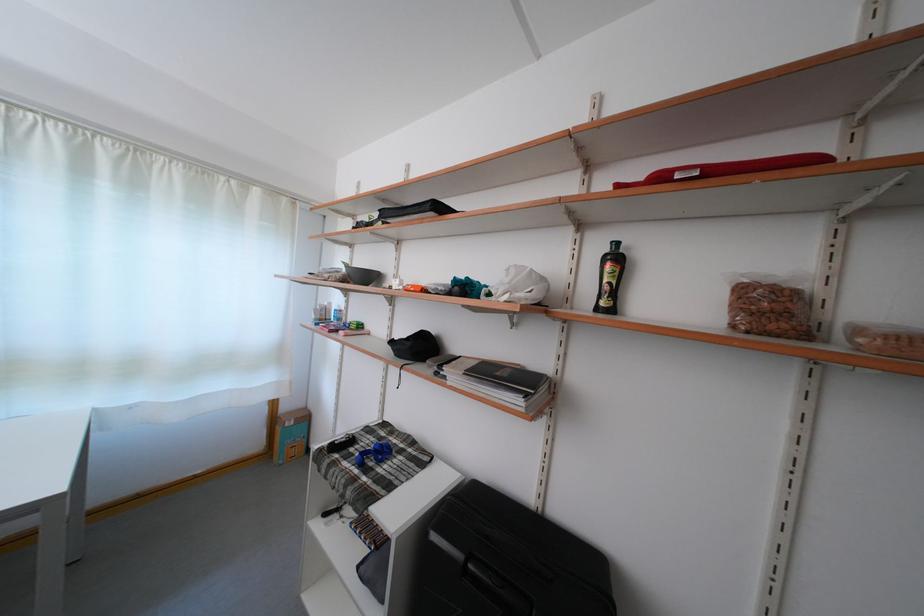
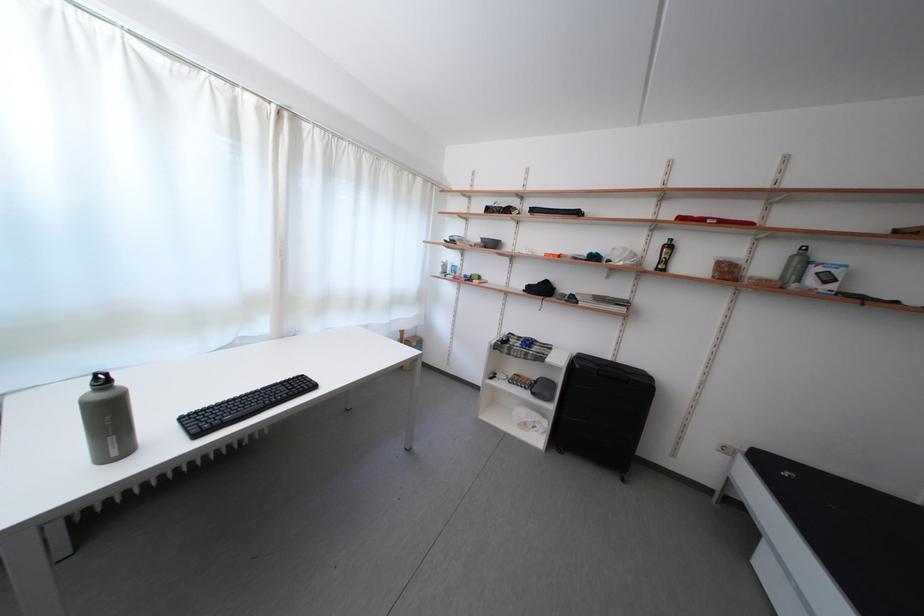
In the second image, find the point that corresponds to the point at 782,321 in the first image.

(736, 278)